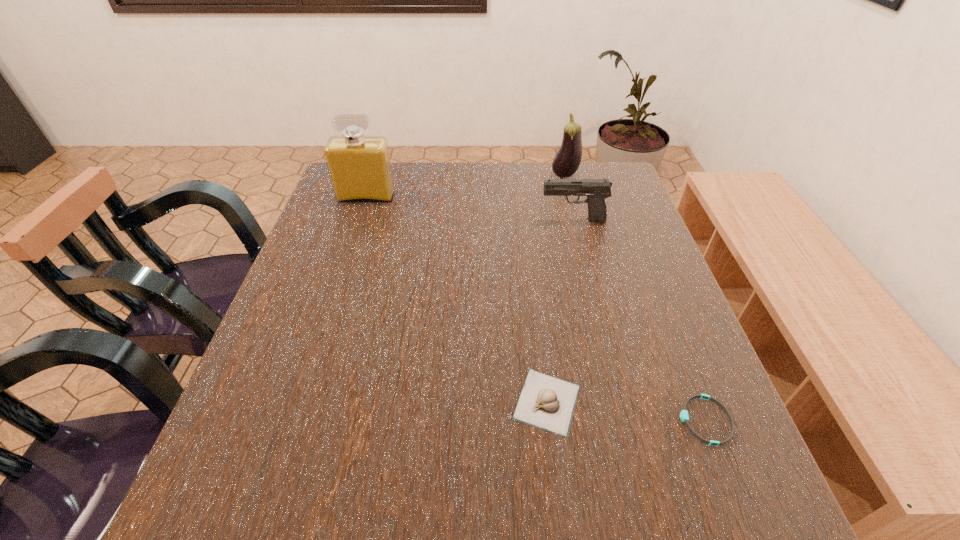
Locate an element on the screen. The image size is (960, 540). object that is at the left edge is located at coordinates (359, 167).

Where is `eggplant present at the right edge`? The image size is (960, 540). eggplant present at the right edge is located at coordinates (566, 162).

Where is `pistol present at the right edge`? The image size is (960, 540). pistol present at the right edge is located at coordinates (597, 190).

You are a GUI agent. You are given a task and a screenshot of the screen. Output one action in this format:
    pyautogui.click(x=<x>, y=<y>)
    Task: Click on the wristband that is at the right edge
    
    Given the screenshot: What is the action you would take?
    pyautogui.click(x=684, y=417)

What are the coordinates of `object that is at the far left corner` in the screenshot? It's located at (359, 167).

The image size is (960, 540). In order to click on object that is at the far right corner in this screenshot , I will do `click(566, 162)`.

In the image, there is a desktop. Identify the location of vacant space at the far edge. The width and height of the screenshot is (960, 540). (516, 206).

I want to click on vacant area at the near edge, so click(x=305, y=523).

You are a GUI agent. You are given a task and a screenshot of the screen. Output one action in this format:
    pyautogui.click(x=<x>, y=<y>)
    Task: Click on the free space at the left edge of the desktop
    This screenshot has height=540, width=960.
    Given the screenshot: What is the action you would take?
    pyautogui.click(x=341, y=342)

Identify the location of vacant space at the right edge. This screenshot has width=960, height=540. (667, 382).